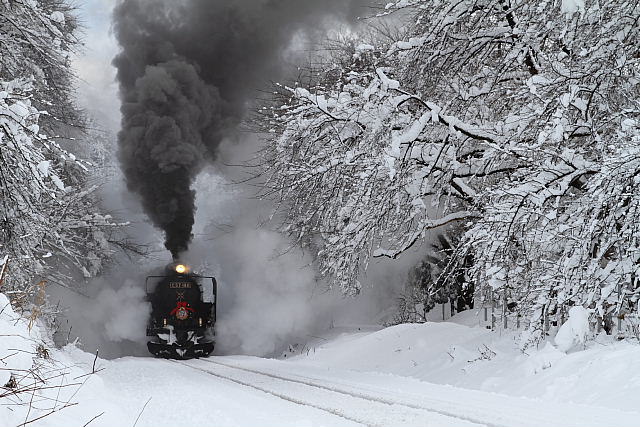
Find the location of a particular element. light is located at coordinates (164, 321).